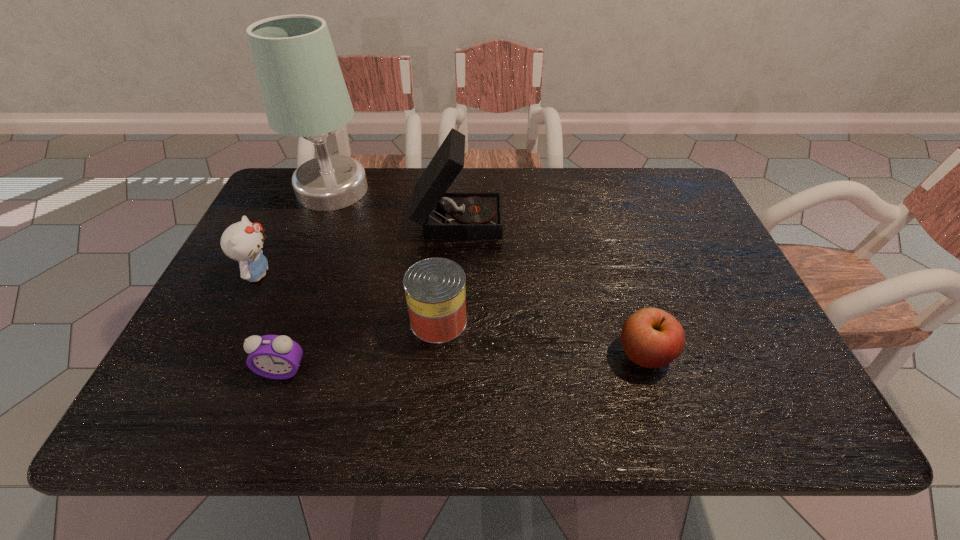
The height and width of the screenshot is (540, 960). In order to click on vacant space at the near left corner in this screenshot , I will do `click(205, 415)`.

Where is `free space at the far right corner of the desktop`? This screenshot has height=540, width=960. free space at the far right corner of the desktop is located at coordinates (648, 211).

This screenshot has height=540, width=960. I want to click on free space between the second tallest object and the fourth nearest object, so click(358, 246).

At what (x,y) coordinates should I click in order to perform the action: click on unoccupied area between the lampshade and the third farthest object. Please return your answer as a coordinate pair (x, y). Looking at the image, I should click on (296, 232).

Locate an element on the screen. free space between the kitten and the tallest object is located at coordinates (296, 232).

Locate an element on the screen. free space between the alarm clock and the lampshade is located at coordinates (307, 280).

Where is `vacant space that is in between the alarm clock and the kitten`? Image resolution: width=960 pixels, height=540 pixels. vacant space that is in between the alarm clock and the kitten is located at coordinates point(271,322).

Locate an element on the screen. free spot between the can and the alarm clock is located at coordinates (361, 346).

What are the coordinates of `vacant space that is in between the can and the tallest object` in the screenshot? It's located at (386, 255).

Image resolution: width=960 pixels, height=540 pixels. Find the location of `unoccupied area between the can and the tallest object`. unoccupied area between the can and the tallest object is located at coordinates (386, 255).